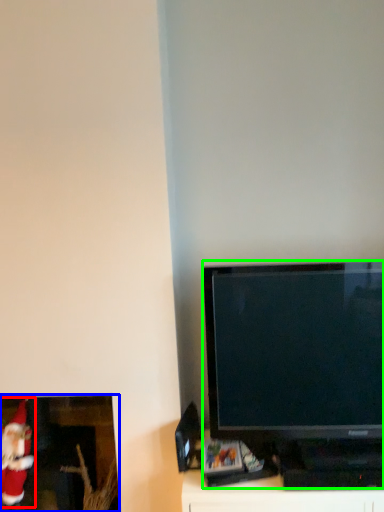
Question: Based on their relative distances, which object is farther from santa claus (highlighted by a red box)? Choose from picture frame (highlighted by a blue box) and television (highlighted by a green box).

Choices:
 (A) picture frame
 (B) television

Answer: (B)